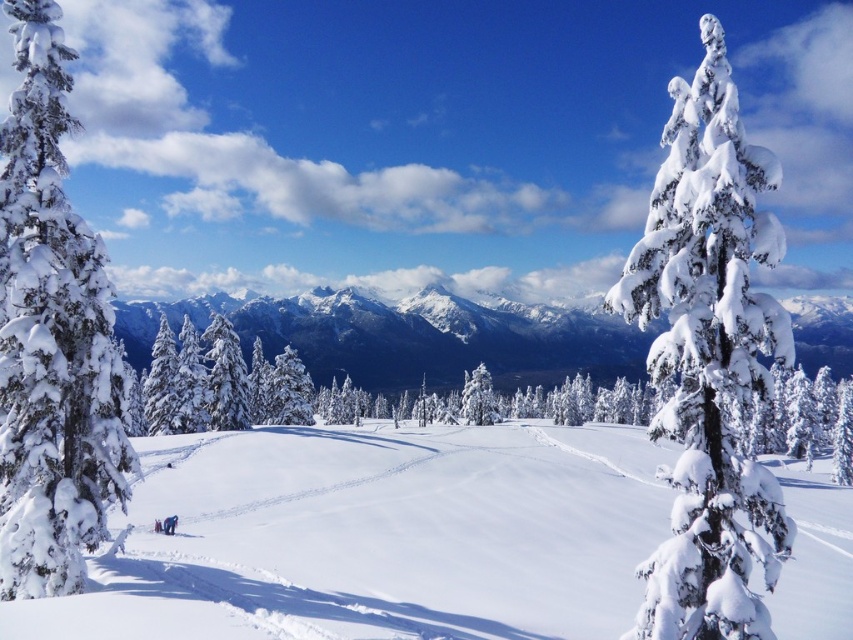
You are standing at the bottom of the snowy slope and see the white frosty tree at center and the white snowboard at lower left. Which object is located to the right of the other?

The white frosty tree at center is positioned on the right side of white snowboard at lower left.

You are standing at the edge of the snowy landscape and want to take a photo of the white frosty tree at center and the white snowboard at lower left. Which object should you zoom in on to capture both in the frame without moving your camera position?

The white frosty tree at center is larger than the white snowboard at lower left, so you should zoom in on the white snowboard at lower left to include both in the frame without moving the camera.